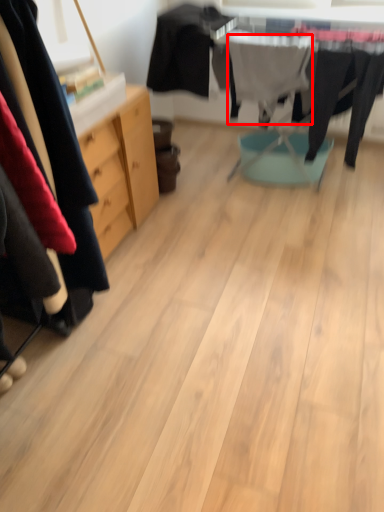
Question: From the image's perspective, where is clothing (annotated by the red box) located in relation to clothing in the image?

Choices:
 (A) above
 (B) below

Answer: (B)